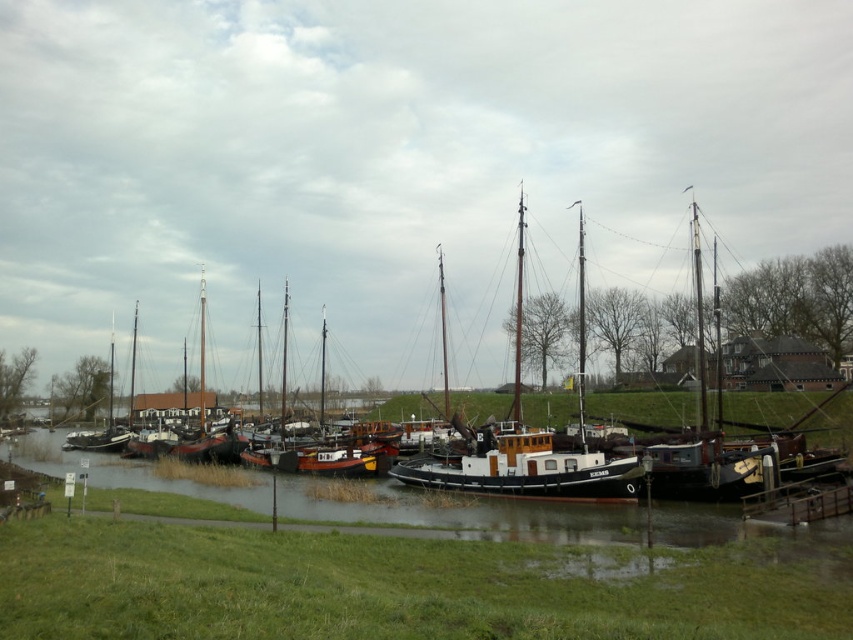
You are a tour guide leading a group along the riverside. You notice a wooden boat at center and a wooden sailboat at center. Your group wants to walk from one to the other. How far apart are these two boats in feet?

The wooden boat at center and wooden sailboat at center are 24.08 feet apart.

You are standing on the wooden dock at lower right and want to reach the smooth water at center. Which direction should you move to get there?

To reach the smooth water at center from the wooden dock at lower right, you should move forward since the smooth water at center is in front of the wooden dock at lower right.